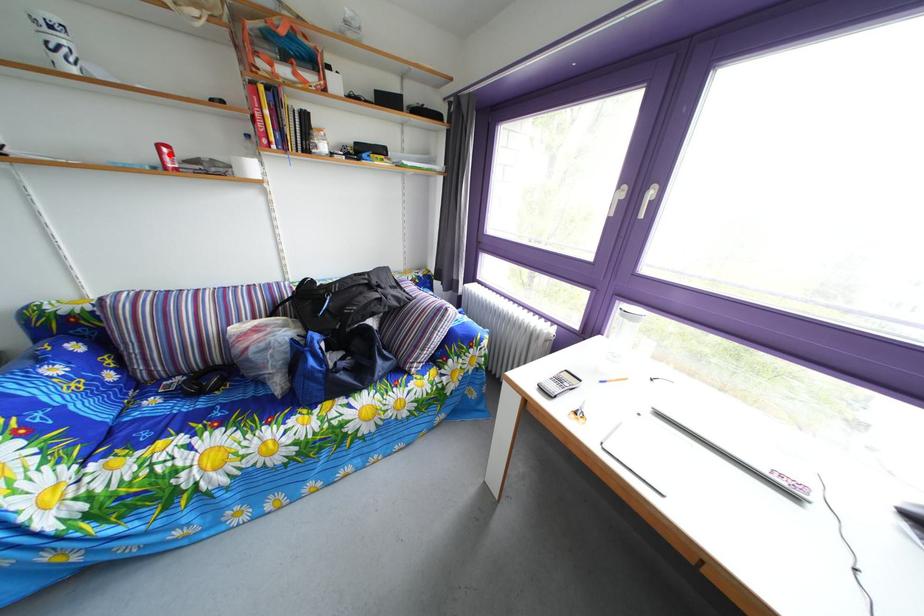
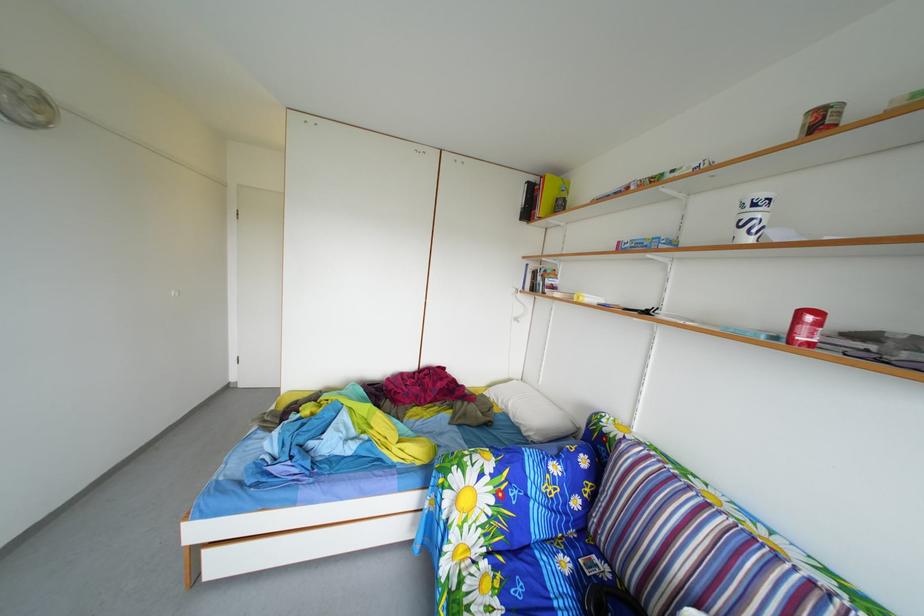
In the second image, find the point that corresponds to the highlighted location in the first image.

(811, 321)